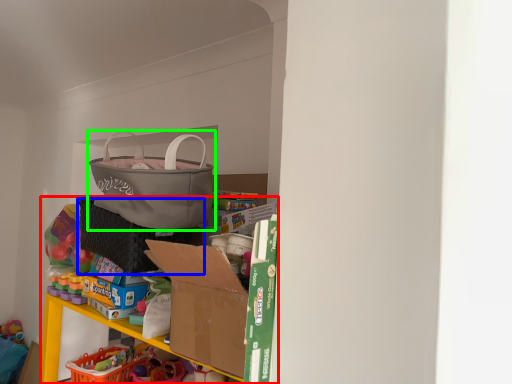
Question: Estimate the real-world distances between objects in this image. Which object is farther from bookshelf (highlighted by a red box), laundry basket (highlighted by a blue box) or handbag (highlighted by a green box)?

Choices:
 (A) laundry basket
 (B) handbag

Answer: (B)